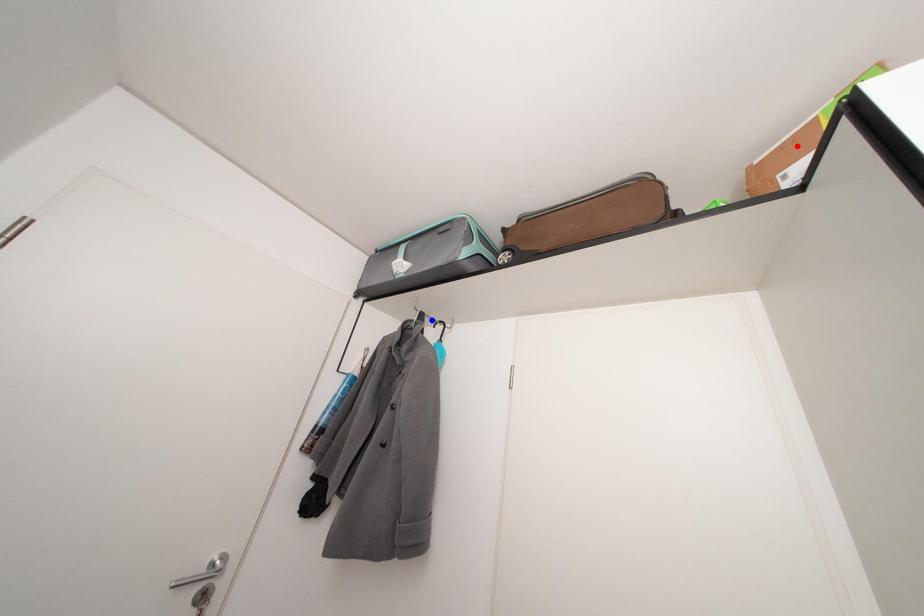
Question: Two points are marked on the image. Which point is closer to the camera?

Choices:
 (A) Blue point is closer.
 (B) Red point is closer.

Answer: (B)